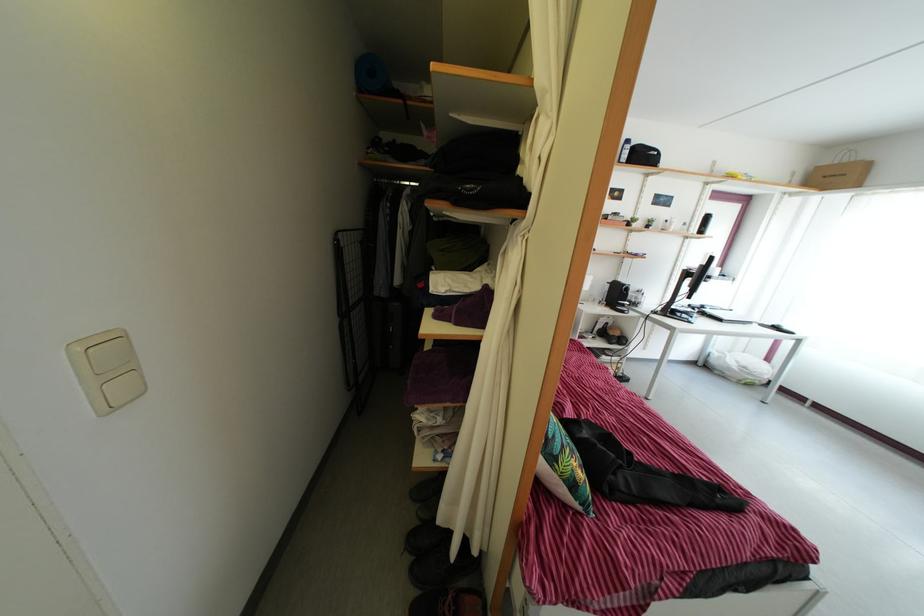
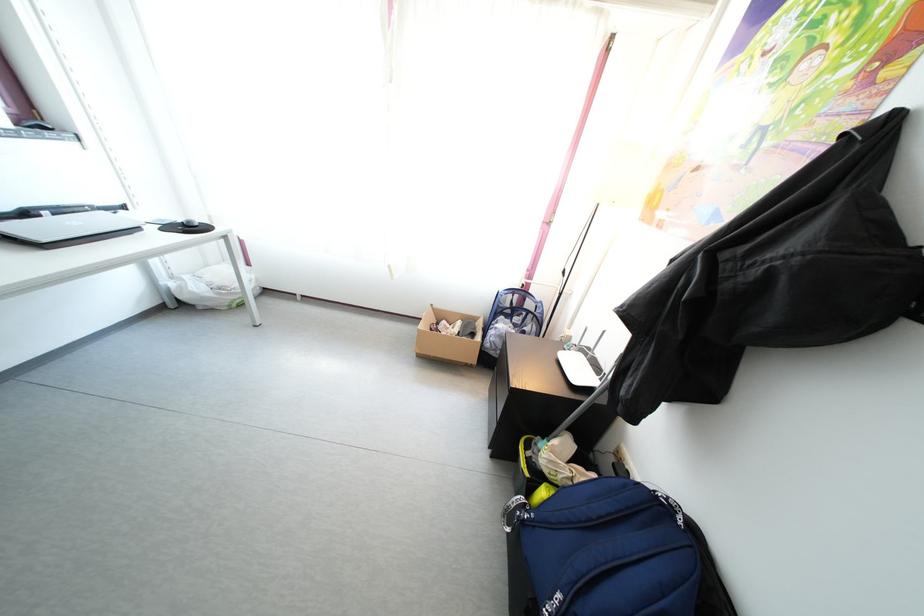
Locate, in the second image, the point that corresponds to point 709,315 in the first image.

(31, 222)